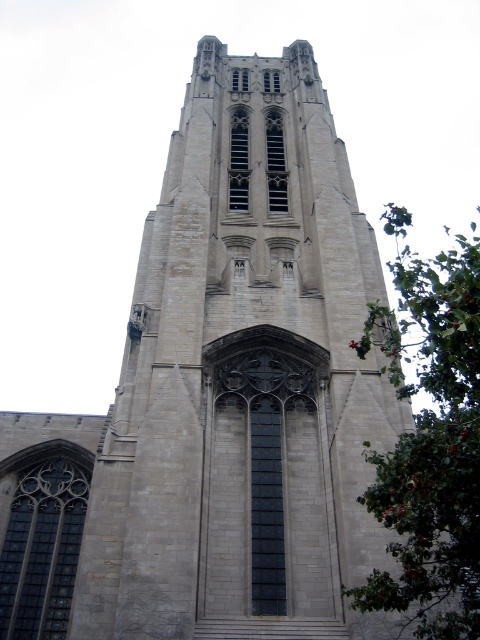
What is the color of the material at the point with coordinates (242, 380)?

The point at coordinates (242, 380) corresponds to the gray stone tower at center, so the color is gray.

Based on the photo, you are standing in front of the gray stone tower at center and the green leafy tree at right. Which structure has a wider base?

The green leafy tree at right has a wider base than the gray stone tower at center.

You are standing in a park and see the gray stone tower at center in the distance. If you want to take a photo that includes the entire tower without any cropping, what should you consider about your current distance?

The gray stone tower at center is 39.70 meters away from the camera. To capture the entire tower in one photo without cropping, ensure you are positioned at least 39.70 meters away from the tower.